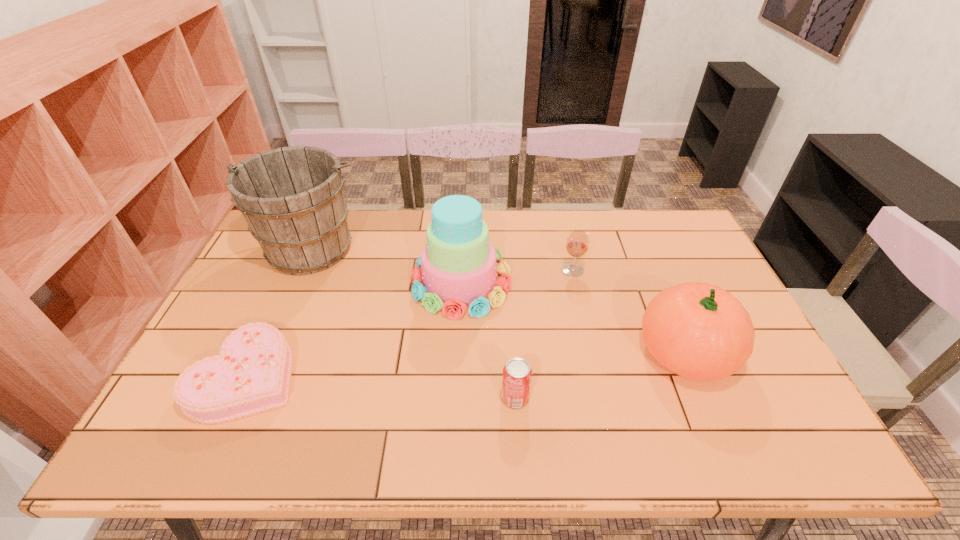
Where is `vacant space located on the left of the fourth shortest object`? vacant space located on the left of the fourth shortest object is located at coordinates (x=599, y=352).

You are a GUI agent. You are given a task and a screenshot of the screen. Output one action in this format:
    pyautogui.click(x=<x>, y=<y>)
    Task: Click on the vacant space located on the front of the wineglass
    The image size is (960, 540).
    Given the screenshot: What is the action you would take?
    pyautogui.click(x=594, y=365)

Identify the location of vacant region located on the right of the soda can. (550, 397).

I want to click on vacant area situated on the back of the nearer cake, so click(304, 249).

In order to click on bucket located in the far edge section of the desktop in this screenshot , I will do `click(292, 198)`.

Where is `cake at the far edge`? This screenshot has width=960, height=540. cake at the far edge is located at coordinates (457, 267).

This screenshot has width=960, height=540. In order to click on object positioned at the near edge in this screenshot , I will do `click(251, 374)`.

Where is `bucket positioned at the left edge`? bucket positioned at the left edge is located at coordinates (292, 198).

Find the location of a particular element. Image resolution: width=960 pixels, height=540 pixels. cake that is at the left edge is located at coordinates (251, 374).

This screenshot has width=960, height=540. What are the coordinates of `object situated at the right edge` in the screenshot? It's located at (699, 331).